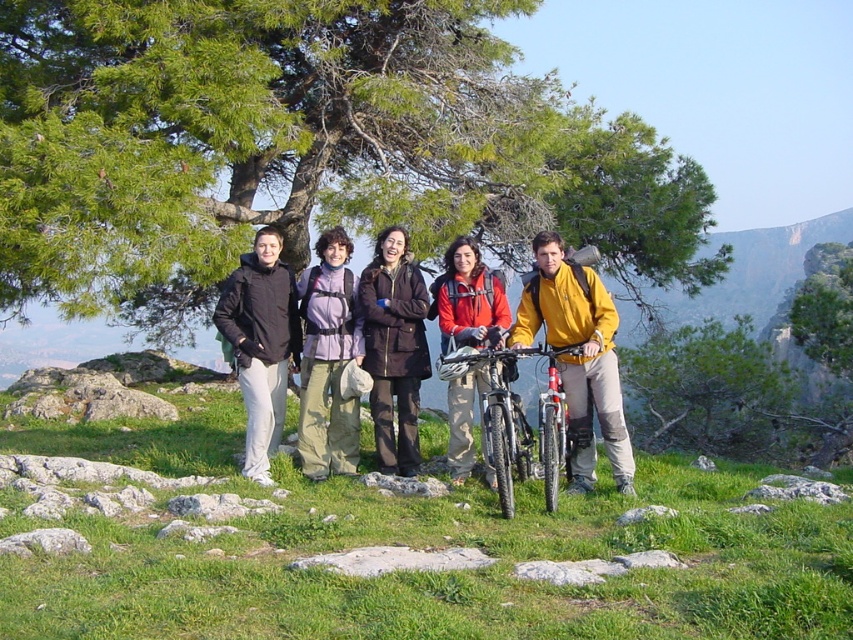
Question: Can you confirm if black matte jacket at center is positioned above matte black jacket at center?

Choices:
 (A) yes
 (B) no

Answer: (B)

Question: Observing the image, what is the correct spatial positioning of black matte mountain bike at center in reference to matte orange jacket at center?

Choices:
 (A) left
 (B) right

Answer: (B)

Question: Which object is positioned closest to the purple softshell jacket at center?

Choices:
 (A) matte orange jacket at center
 (B) green leafy tree at upper center
 (C) matte black jacket at center
 (D) green leafy tree at center

Answer: (C)

Question: Which point appears closest to the camera in this image?

Choices:
 (A) (497, 579)
 (B) (498, 481)
 (C) (631, 413)
 (D) (314, 352)

Answer: (A)

Question: Does green leafy tree at upper center have a smaller size compared to purple softshell jacket at center?

Choices:
 (A) no
 (B) yes

Answer: (A)

Question: Which object is farther from the camera taking this photo?

Choices:
 (A) matte orange jacket at center
 (B) green grassy at center

Answer: (A)